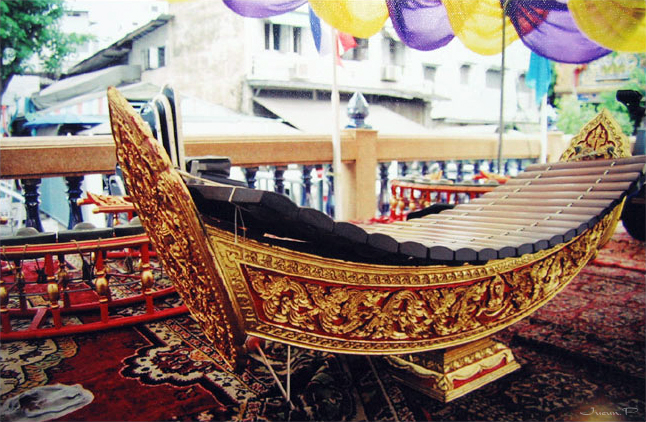
Identify the location of yellow fabric. (x=351, y=14), (x=471, y=26), (x=596, y=26).